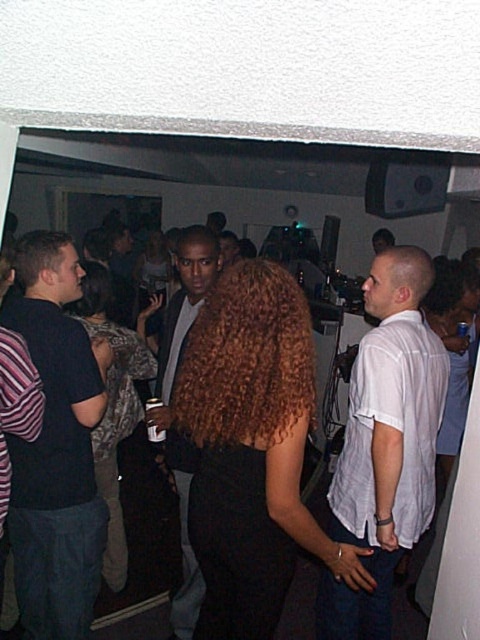
Question: Can you confirm if dark blue shirt at center is positioned to the right of curly hair at center?

Choices:
 (A) no
 (B) yes

Answer: (B)

Question: Which object is the closest to the curly hair at center?

Choices:
 (A) striped knit sweater at left
 (B) matte black dress at center
 (C) dark blue shirt at center
 (D) leather jacket at center

Answer: (B)

Question: Does shiny black dress at center have a larger size compared to leather jacket at center?

Choices:
 (A) yes
 (B) no

Answer: (B)

Question: Does shiny black dress at center have a larger size compared to striped knit sweater at left?

Choices:
 (A) no
 (B) yes

Answer: (B)

Question: Which point is farther from the camera taking this photo?

Choices:
 (A) (159, 346)
 (B) (93, 268)

Answer: (B)

Question: Which of the following is the farthest from the observer?

Choices:
 (A) leather jacket at center
 (B) striped knit sweater at left
 (C) shiny black dress at center

Answer: (A)